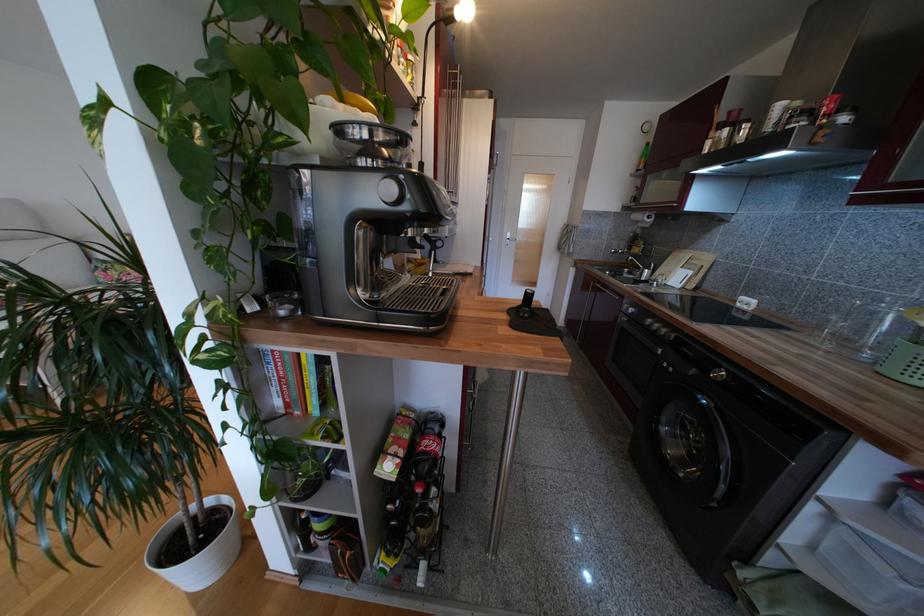
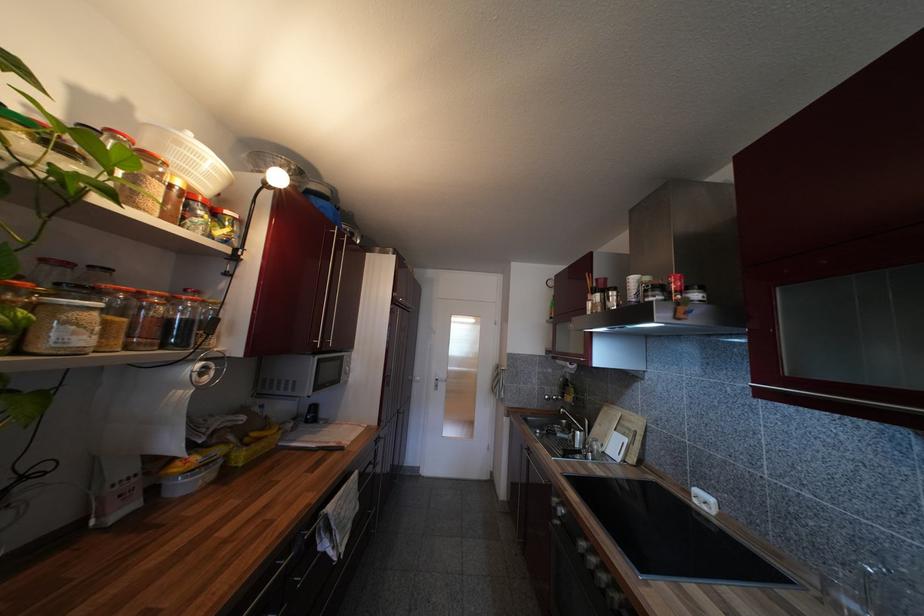
Locate, in the second image, the point that corresponds to (653,323) in the first image.

(587, 546)